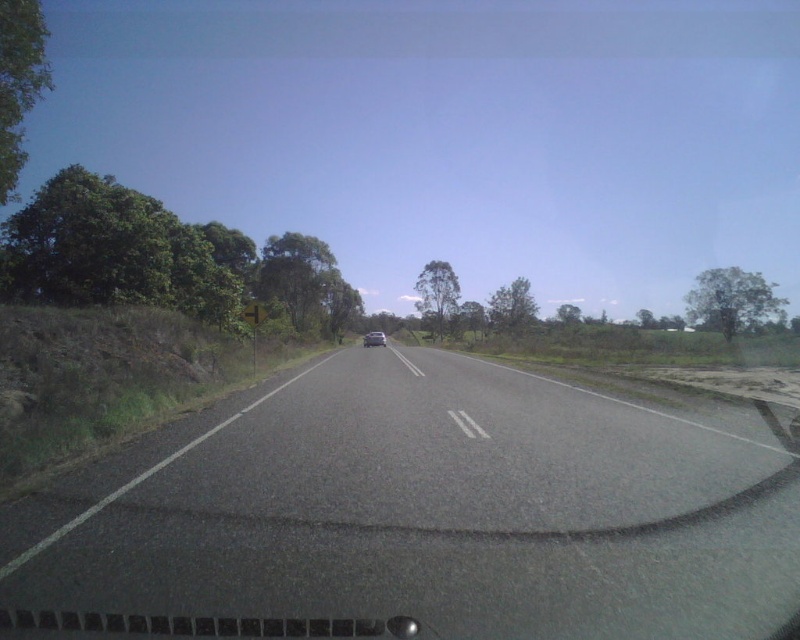
You are driving a car and see the asphalt road at center and the satin silver sedan at center ahead. Which one is closer to you?

The asphalt road at center is in front of the satin silver sedan at center, so the asphalt road at center is closer to you.

You are driving a car and want to know how far the asphalt road at center extends beyond the satin silver sedan at center. Can you determine the distance?

The asphalt road at center is 50.63 meters from the satin silver sedan at center, so it extends approximately 50.63 meters beyond the sedan.

You are driving a car and see the point marked at coordinates point (x=688, y=548) on the road ahead. Can you safely stop before reaching it if you apply the brakes immediately?

The point (x=688, y=548) is 5.36 meters away from the viewer. If the car can stop within 5.36 meters, then yes, but if not, it might not be safe. The exact stopping distance depends on the car speed and braking efficiency.